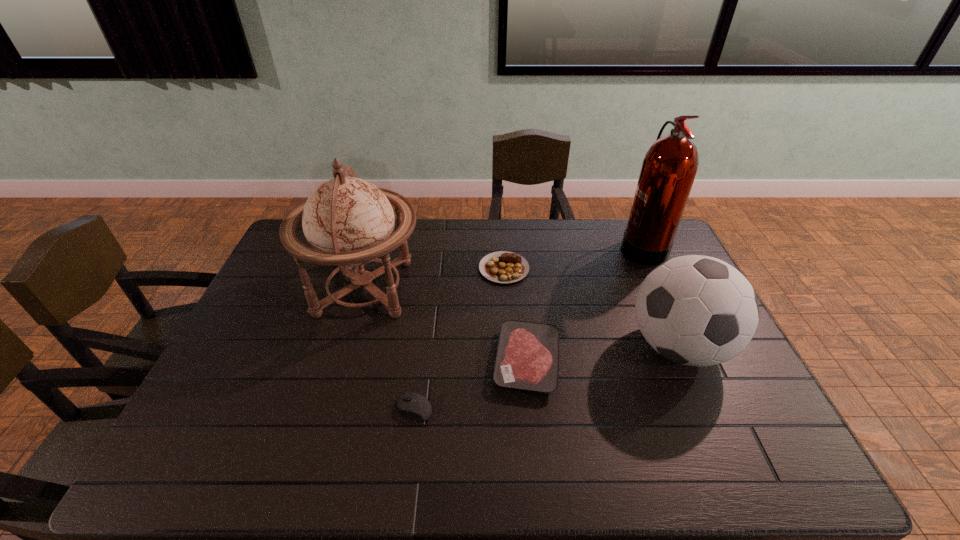
You are a GUI agent. You are given a task and a screenshot of the screen. Output one action in this format:
    pyautogui.click(x=<x>, y=<y>)
    Task: Click on the object that is positioned at the far left corner
    
    Given the screenshot: What is the action you would take?
    pyautogui.click(x=348, y=222)

Locate an element on the screen. object present at the far right corner is located at coordinates (669, 168).

Locate an element on the screen. The width and height of the screenshot is (960, 540). vacant position at the far edge of the desktop is located at coordinates (619, 231).

Locate an element on the screen. This screenshot has height=540, width=960. vacant space at the near edge is located at coordinates (269, 474).

This screenshot has height=540, width=960. In order to click on vacant area at the left edge of the desktop in this screenshot , I will do `click(294, 301)`.

What are the coordinates of `vacant region at the right edge of the desktop` in the screenshot? It's located at (718, 420).

Find the location of `empty space that is in between the nearer steak and the fire extinguisher`. empty space that is in between the nearer steak and the fire extinguisher is located at coordinates (585, 303).

The width and height of the screenshot is (960, 540). I want to click on empty space between the nearer steak and the globe, so click(445, 325).

I want to click on unoccupied position between the nearer steak and the fire extinguisher, so click(585, 303).

Locate an element on the screen. The height and width of the screenshot is (540, 960). blank region between the computer equipment and the farther steak is located at coordinates (459, 339).